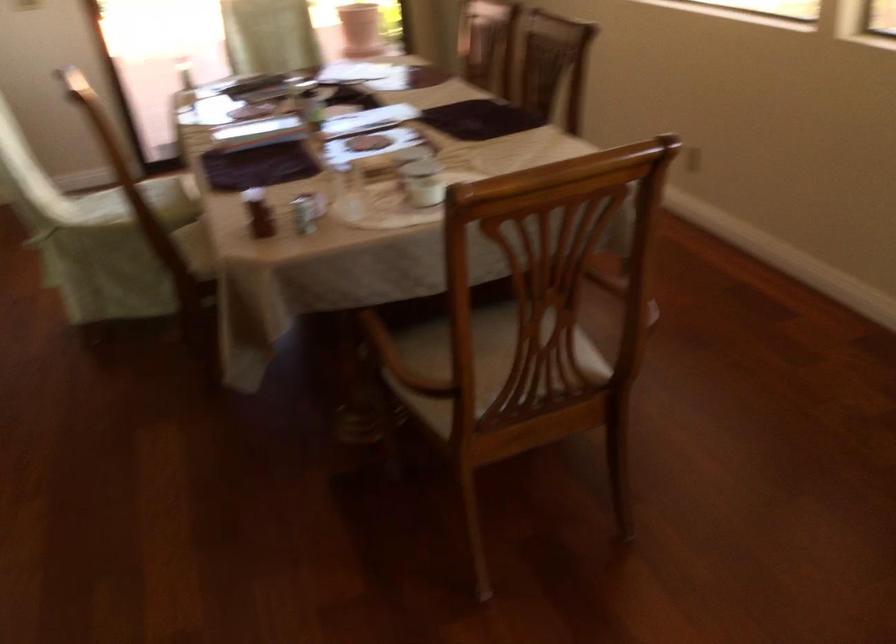
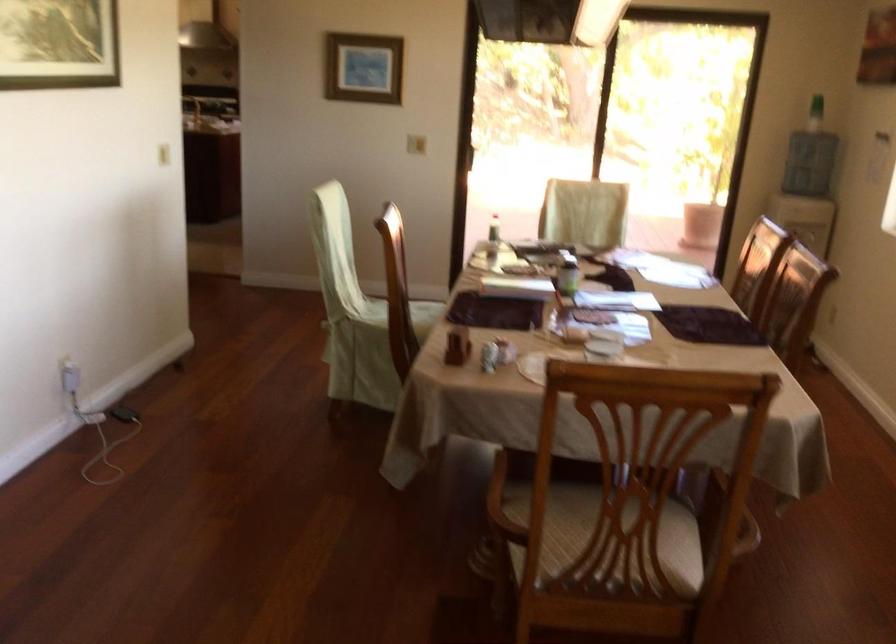
Question: I am providing you with two images of the same scene from different viewpoints. Please identify which objects are invisible in image2.

Choices:
 (A) black phone charger
 (B) bottle with red top
 (C) chair sitting surface
 (D) none of these

Answer: (D)